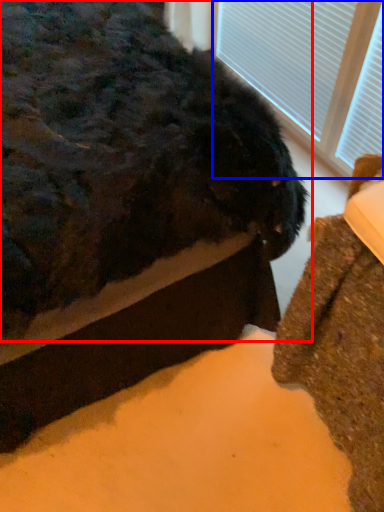
Question: Which object is closer to the camera taking this photo, animal (highlighted by a red box) or bay window (highlighted by a blue box)?

Choices:
 (A) animal
 (B) bay window

Answer: (A)